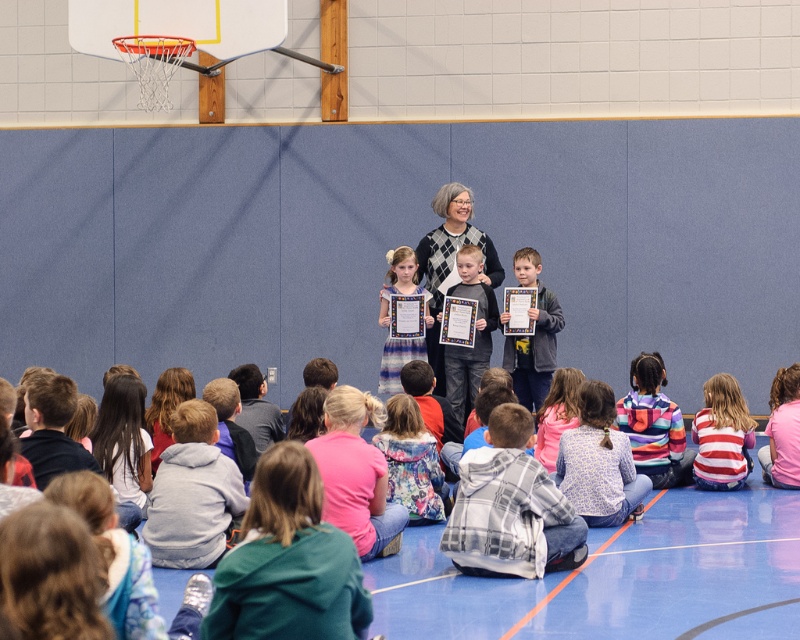
Question: Which object is closer to the camera taking this photo?

Choices:
 (A) striped cotton shirt at lower right
 (B) light blue jeans at center
 (C) floral dress at center
 (D) gray fleece hoodie at lower left

Answer: (C)

Question: Which is nearer to the floral-patterned jacket at center?

Choices:
 (A) floral dress at center
 (B) green fleece jacket at lower center

Answer: (A)

Question: Which object appears closest to the camera in this image?

Choices:
 (A) floral dress at center
 (B) light brown wooden frame at center
 (C) light blue jeans at center
 (D) blue printed dress at center

Answer: (A)

Question: From the image, what is the correct spatial relationship of gray fleece hoodie at lower left in relation to light brown wooden frame at center?

Choices:
 (A) left
 (B) right

Answer: (A)

Question: Considering the relative positions of green fleece jacket at lower center and blue printed dress at center in the image provided, where is green fleece jacket at lower center located with respect to blue printed dress at center?

Choices:
 (A) above
 (B) below

Answer: (B)

Question: Can you confirm if patterned fabric shirt at lower right is wider than light brown wooden frame at center?

Choices:
 (A) yes
 (B) no

Answer: (A)